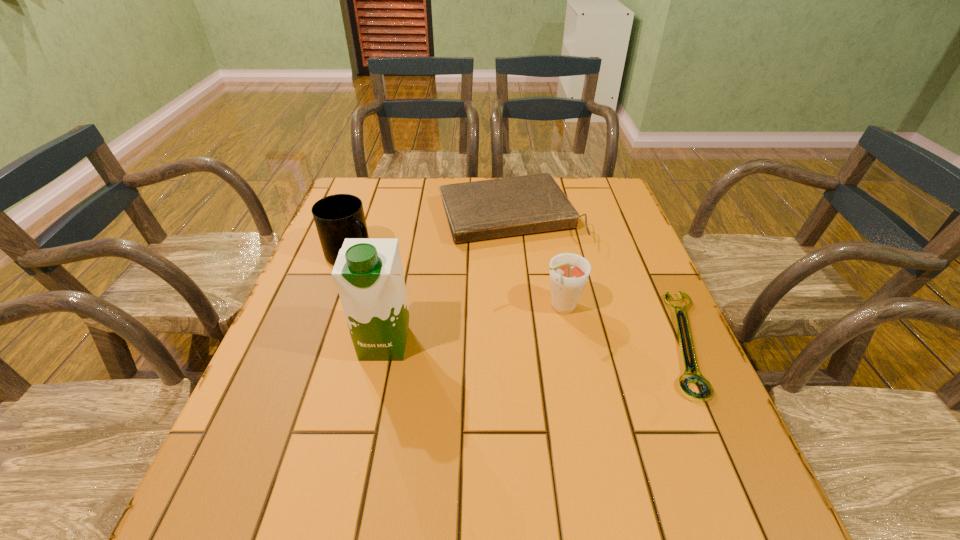
Find the location of a particular element. Image resolution: width=960 pixels, height=540 pixels. vacant region located on the side of the mug with the handle is located at coordinates (472, 330).

Find the location of a particular element. free space located 0.120m on the side of the mug with the handle is located at coordinates (398, 284).

Locate an element on the screen. This screenshot has height=540, width=960. free space located 0.050m on the spine side of the fourth tallest object is located at coordinates (535, 257).

This screenshot has width=960, height=540. What are the coordinates of `vacant space located on the spine side of the fourth tallest object` in the screenshot? It's located at (537, 261).

Locate an element on the screen. blank space located on the spine side of the fourth tallest object is located at coordinates (579, 340).

Image resolution: width=960 pixels, height=540 pixels. Find the location of `vacant space located 0.240m on the drink side of the root beer`. vacant space located 0.240m on the drink side of the root beer is located at coordinates (458, 360).

Find the location of a particular element. This screenshot has height=540, width=960. free space located on the drink side of the root beer is located at coordinates (389, 395).

Where is `vacant space situated 0.230m on the drink side of the root beer`? vacant space situated 0.230m on the drink side of the root beer is located at coordinates (462, 359).

The width and height of the screenshot is (960, 540). Identify the location of object at the far edge. (478, 210).

This screenshot has height=540, width=960. Identify the location of object located in the left edge section of the desktop. (337, 217).